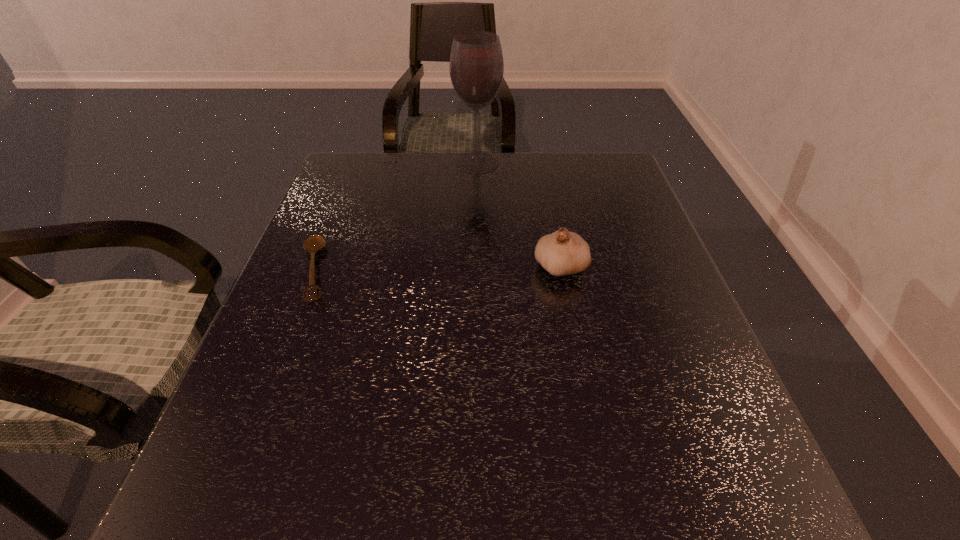
Identify the location of free space between the garlic and the ladle. This screenshot has height=540, width=960. (438, 269).

Where is `empty location between the rightmost object and the shortest object`? This screenshot has width=960, height=540. empty location between the rightmost object and the shortest object is located at coordinates (438, 269).

This screenshot has height=540, width=960. I want to click on blank region between the garlic and the ladle, so point(438,269).

This screenshot has width=960, height=540. I want to click on free space that is in between the shortest object and the farthest object, so click(396, 217).

The width and height of the screenshot is (960, 540). In order to click on unoccupied area between the tallest object and the second tallest object in this screenshot , I will do `click(518, 215)`.

The width and height of the screenshot is (960, 540). Identify the location of free space that is in between the shortest object and the tallest object. (396, 217).

Find the location of `free spot between the tallest object and the leftmost object`. free spot between the tallest object and the leftmost object is located at coordinates (396, 217).

The width and height of the screenshot is (960, 540). Identify the location of free space between the garlic and the second object from left to right. (518, 215).

Find the location of a particular element. empty location between the alcohol and the ladle is located at coordinates tap(396, 217).

The height and width of the screenshot is (540, 960). Identify the location of the second closest object to the garlic. click(x=314, y=243).